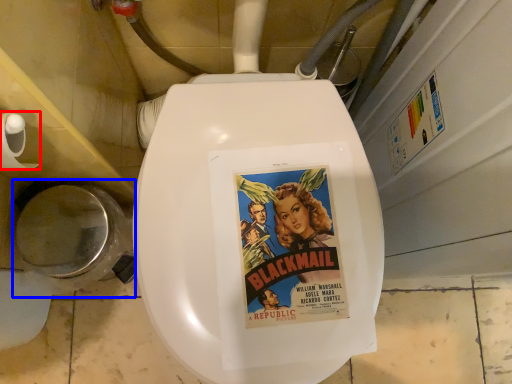
Question: Which object appears closest to the camera in this image, toilet paper (highlighted by a red box) or toilet bowl (highlighted by a blue box)?

Choices:
 (A) toilet paper
 (B) toilet bowl

Answer: (A)